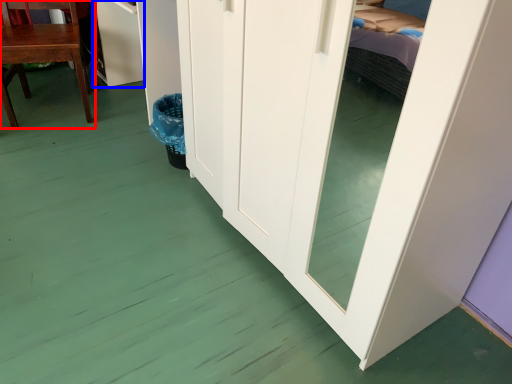
Question: Which object appears farthest to the camera in this image, chair (highlighted by a red box) or cabinetry (highlighted by a blue box)?

Choices:
 (A) chair
 (B) cabinetry

Answer: (B)